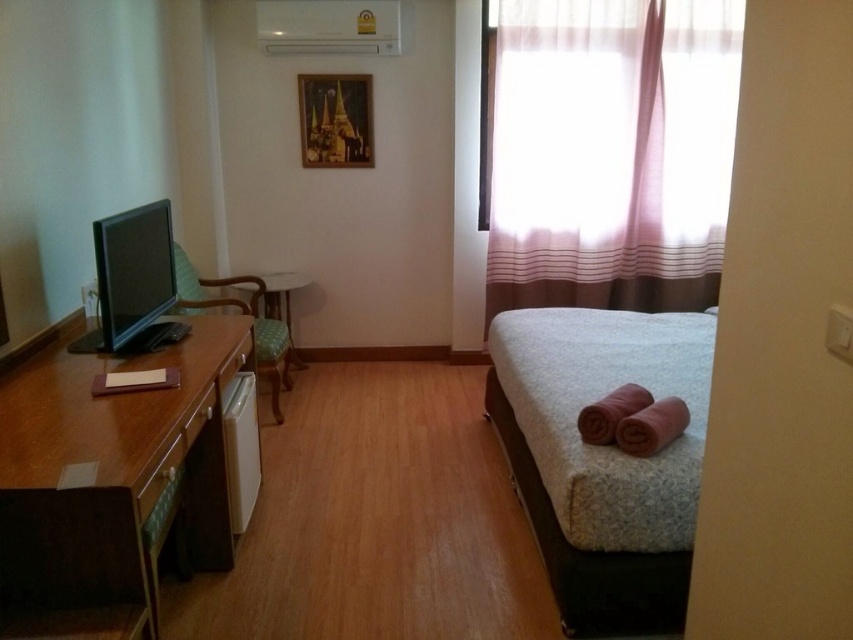
Is sheer pink fabric at upper right wider than green fabric table at center?

Correct, the width of sheer pink fabric at upper right exceeds that of green fabric table at center.

Can you confirm if sheer pink fabric at upper right is positioned above green fabric table at center?

Indeed, sheer pink fabric at upper right is positioned over green fabric table at center.

Where is `sheer pink fabric at upper right`? sheer pink fabric at upper right is located at coordinates (611, 152).

Which of these two, brown wood dresser at left or green fabric table at center, stands shorter?

With less height is green fabric table at center.

The height and width of the screenshot is (640, 853). I want to click on brown wood dresser at left, so click(x=113, y=477).

Does point (26, 420) lie in front of point (271, 282)?

Yes.

Identify the location of brown wood dresser at left. (113, 477).

Image resolution: width=853 pixels, height=640 pixels. What do you see at coordinates (602, 456) in the screenshot? I see `white textured bed at right` at bounding box center [602, 456].

Identify the location of white textured bed at right. (602, 456).